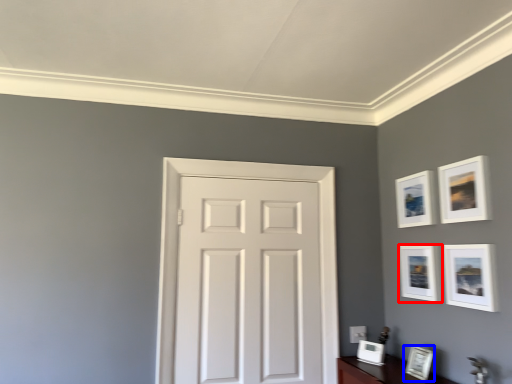
Question: Which object appears farthest to the camera in this image, picture frame (highlighted by a red box) or picture frame (highlighted by a blue box)?

Choices:
 (A) picture frame
 (B) picture frame

Answer: (A)